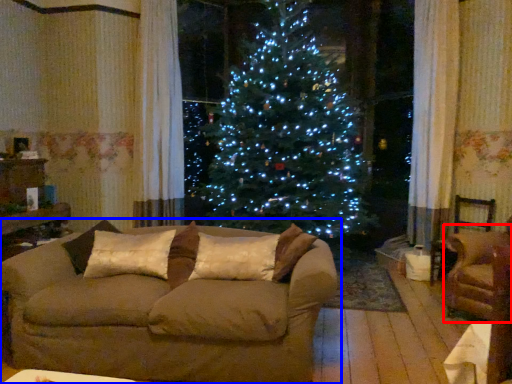
Question: Which point is further to the camera, armchair (highlighted by a red box) or studio couch (highlighted by a blue box)?

Choices:
 (A) armchair
 (B) studio couch

Answer: (A)